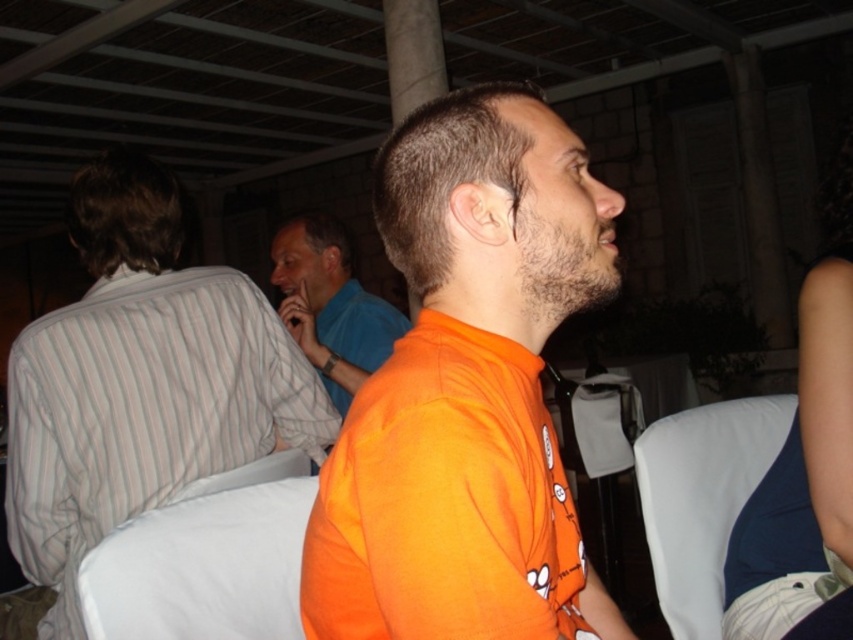
The image size is (853, 640). What do you see at coordinates (467, 390) in the screenshot? I see `orange cotton shirt at center` at bounding box center [467, 390].

Can you confirm if orange cotton shirt at center is positioned above blue smooth shirt at center?

No, orange cotton shirt at center is not above blue smooth shirt at center.

Which is in front, point (505, 292) or point (334, 282)?

Point (505, 292) is more forward.

In order to click on orange cotton shirt at center in this screenshot , I will do `click(467, 390)`.

Can you confirm if striped cotton shirt at left is positioned below white fabric chair at right?

No.

In order to click on striped cotton shirt at left in this screenshot , I will do `click(140, 381)`.

Is point (171, 435) farther from camera compared to point (662, 524)?

No, it is in front of (662, 524).

Locate an element on the screen. striped cotton shirt at left is located at coordinates (140, 381).

Is striped cotton shirt at left closer to camera compared to blue smooth shirt at center?

That is True.

Which is behind, point (114, 170) or point (317, 230)?

The point (317, 230) is behind.

Locate an element on the screen. This screenshot has height=640, width=853. striped cotton shirt at left is located at coordinates (140, 381).

Where is `striped cotton shirt at left`? Image resolution: width=853 pixels, height=640 pixels. striped cotton shirt at left is located at coordinates (140, 381).